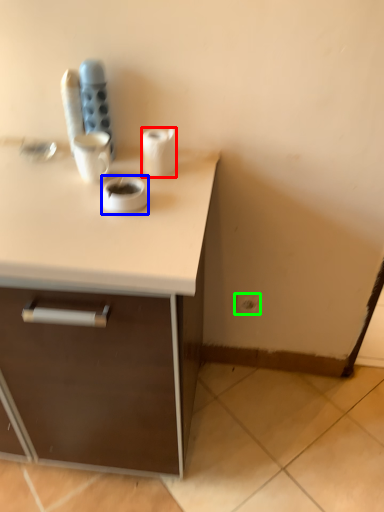
Question: Which is nearer to the paper towel (highlighted by a red box)? coffee (highlighted by a blue box) or electric outlet (highlighted by a green box).

Choices:
 (A) coffee
 (B) electric outlet

Answer: (A)